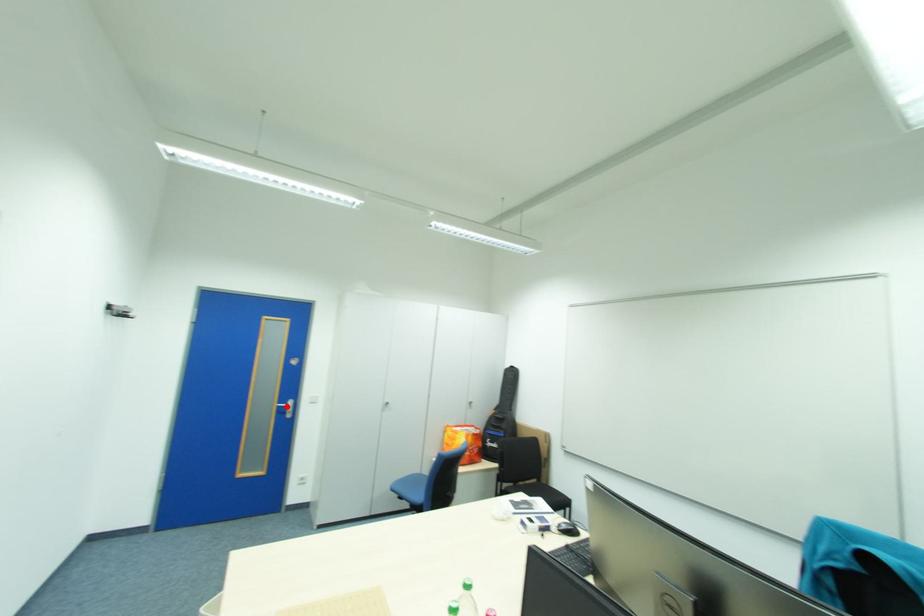
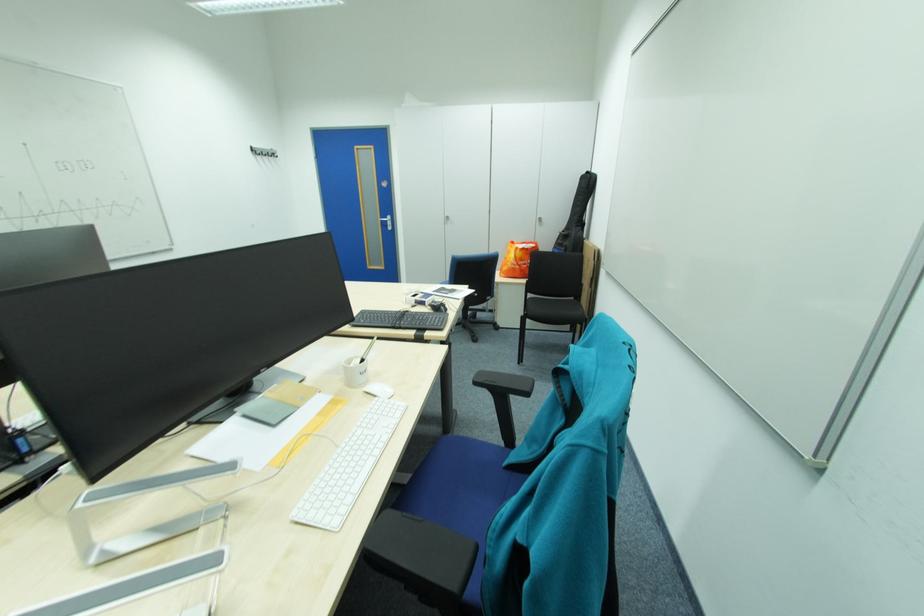
Question: I am providing you with two images of the same scene from different viewpoints. In image1, a red point is highlighted. Considering the same 3D point in image2, which of the following is correct?

Choices:
 (A) It is closer
 (B) It is farther

Answer: (A)